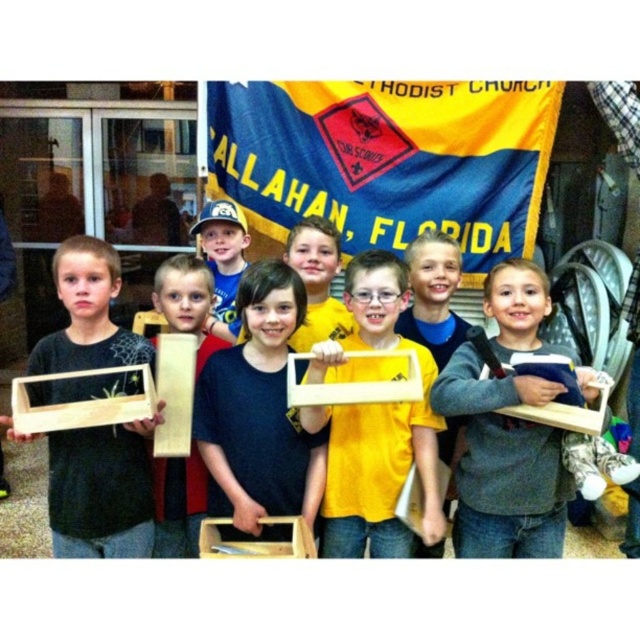
Is matte wood frame at center bigger than matte black shirt at center?

Indeed, matte wood frame at center has a larger size compared to matte black shirt at center.

Who is more forward, (314, 412) or (216, 355)?

Point (314, 412) is more forward.

Who is more forward, (390, 428) or (276, 340)?

Point (276, 340)

Find the location of `matte wood frame at center`. matte wood frame at center is located at coordinates (374, 422).

What do you see at coordinates (100, 492) in the screenshot? Image resolution: width=640 pixels, height=640 pixels. I see `matte wood box at left` at bounding box center [100, 492].

Is point (84, 284) positioned behind point (316, 493)?

No, (84, 284) is in front of (316, 493).

Is point (81, 554) more distant than point (252, 486)?

No.

The height and width of the screenshot is (640, 640). I want to click on matte wood box at left, so click(x=100, y=492).

Does matte wood frame at center appear on the right side of matte black cap at center?

Indeed, matte wood frame at center is positioned on the right side of matte black cap at center.

Can you confirm if matte wood frame at center is taller than matte black cap at center?

Yes.

Who is more forward, (x=369, y=468) or (x=218, y=272)?

Positioned in front is point (x=369, y=468).

Locate an element on the screen. matte wood frame at center is located at coordinates pos(374,422).